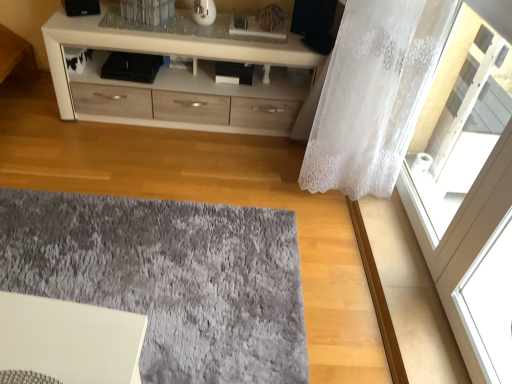
Measure the distance between white glossy cabinet at upper center and camera.

white glossy cabinet at upper center and camera are 1.95 meters apart from each other.

This screenshot has width=512, height=384. What do you see at coordinates (374, 94) in the screenshot?
I see `white lace curtain at right` at bounding box center [374, 94].

The width and height of the screenshot is (512, 384). Find the location of `white glossy cabinet at upper center`. white glossy cabinet at upper center is located at coordinates (163, 53).

Is gray shaggy rug at center a part of white lace curtain at right?

No, gray shaggy rug at center is not inside white lace curtain at right.

Is white lace curtain at right far away from gray shaggy rug at center?

They are positioned close to each other.

Which of these two, gray shaggy rug at center or white lace curtain at right, is wider?

gray shaggy rug at center is wider.

Does gray shaggy rug at center have a larger size compared to white lace curtain at right?

Yes.

Does point (226, 268) come closer to viewer compared to point (450, 153)?

Yes, point (226, 268) is closer to viewer.

Does white glossy cabinet at upper center have a greater height compared to white lace curtain at right?

In fact, white glossy cabinet at upper center may be shorter than white lace curtain at right.

The height and width of the screenshot is (384, 512). Identify the location of the chest of drawers behind the white lace curtain at right. (163, 53).

Is white glossy cabinet at upper center with white lace curtain at right?

No, white glossy cabinet at upper center is not beside white lace curtain at right.

Which object is further away from the camera taking this photo, white glossy cabinet at upper center or white lace curtain at right?

white glossy cabinet at upper center is further from the camera.

Between white lace curtain at right and white glossy cabinet at upper center, which one has more height?

white lace curtain at right is taller.

Considering the positions of objects white lace curtain at right and white glossy cabinet at upper center in the image provided, who is in front, white lace curtain at right or white glossy cabinet at upper center?

white lace curtain at right is more forward.

Measure the distance between white lace curtain at right and white glossy cabinet at upper center.

white lace curtain at right and white glossy cabinet at upper center are 81.30 centimeters apart.

Does point (310, 57) come farther from viewer compared to point (35, 200)?

Yes.

Considering the relative sizes of white glossy cabinet at upper center and gray shaggy rug at center in the image provided, is white glossy cabinet at upper center taller than gray shaggy rug at center?

Yes, white glossy cabinet at upper center is taller than gray shaggy rug at center.

In the scene shown: From the image's perspective, does white glossy cabinet at upper center appear higher than gray shaggy rug at center?

Yes, from the image's perspective, white glossy cabinet at upper center is above gray shaggy rug at center.

Is white lace curtain at right surrounding white lace curtain at right?

No, white lace curtain at right is not inside white lace curtain at right.

From the picture: Is white lace curtain at right in front of or behind white lace curtain at right in the image?

Clearly, white lace curtain at right is in front of white lace curtain at right.

From a real-world perspective, is white lace curtain at right positioned under white lace curtain at right based on gravity?

Incorrect, from a real-world perspective, white lace curtain at right is higher than white lace curtain at right.

From a real-world perspective, is white glossy cabinet at upper center over white lace curtain at right?

No, from a real-world perspective, white glossy cabinet at upper center is not above white lace curtain at right.

Who is shorter, white glossy cabinet at upper center or white lace curtain at right?

white glossy cabinet at upper center.

Between point (226, 53) and point (418, 139), which one is positioned in front?

Positioned in front is point (226, 53).

From the image's perspective, which is above, white glossy cabinet at upper center or white lace curtain at right?

white glossy cabinet at upper center.

Find the location of a particular element. mat lying behind the white lace curtain at right is located at coordinates (169, 278).

I want to click on mat that appears below the white lace curtain at right (from a real-world perspective), so click(x=169, y=278).

Considering their positions, is gray shaggy rug at center positioned further to white glossy cabinet at upper center than white lace curtain at right?

Based on the image, gray shaggy rug at center appears to be further to white glossy cabinet at upper center.

Estimate the real-world distances between objects in this image. Which object is further from white glossy cabinet at upper center, white lace curtain at right or gray shaggy rug at center?

gray shaggy rug at center is further to white glossy cabinet at upper center.

Looking at the image, which one is located closer to white lace curtain at right, gray shaggy rug at center or white glossy cabinet at upper center?

white glossy cabinet at upper center.

Based on their spatial positions, is gray shaggy rug at center or white lace curtain at right further from white lace curtain at right?

Based on the image, gray shaggy rug at center appears to be further to white lace curtain at right.

From the image, which object appears to be farther from white lace curtain at right, gray shaggy rug at center or white lace curtain at right?

gray shaggy rug at center is positioned further to the anchor white lace curtain at right.

When comparing their distances from white glossy cabinet at upper center, does gray shaggy rug at center or white lace curtain at right seem further?

gray shaggy rug at center.

Looking at the image, which one is located closer to white glossy cabinet at upper center, white lace curtain at right or white lace curtain at right?

The object closer to white glossy cabinet at upper center is white lace curtain at right.

Based on the photo, considering their positions, is white glossy cabinet at upper center positioned closer to white lace curtain at right than white lace curtain at right?

Among the two, white lace curtain at right is located nearer to white lace curtain at right.

You are a GUI agent. You are given a task and a screenshot of the screen. Output one action in this format:
    pyautogui.click(x=<x>, y=<y>)
    Task: Click on the chest of drawers located between gray shaggy rug at center and white lace curtain at right in the left-right direction
    The width and height of the screenshot is (512, 384).
    Given the screenshot: What is the action you would take?
    pyautogui.click(x=163, y=53)

Locate an element on the screen. This screenshot has height=384, width=512. curtain between white glossy cabinet at upper center and white lace curtain at right from left to right is located at coordinates (374, 94).

Identify the location of curtain situated between gray shaggy rug at center and white lace curtain at right from left to right. Image resolution: width=512 pixels, height=384 pixels. (374, 94).

Locate an element on the screen. This screenshot has height=384, width=512. chest of drawers between gray shaggy rug at center and white lace curtain at right from left to right is located at coordinates (163, 53).